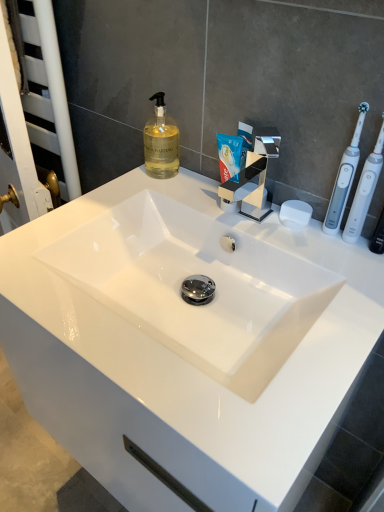
The height and width of the screenshot is (512, 384). Describe the element at coordinates (295, 214) in the screenshot. I see `white matte soap at right` at that location.

Measure the distance between white glossy sink at center and camera.

white glossy sink at center is 16.90 inches away from camera.

You are a GUI agent. You are given a task and a screenshot of the screen. Output one action in this format:
    pyautogui.click(x=<x>, y=<y>)
    Task: Click on the white glossy sink at center
    
    Given the screenshot: What is the action you would take?
    pyautogui.click(x=183, y=343)

Find the location of a particular element. The height and width of the screenshot is (512, 384). chrome metallic tap at center is located at coordinates (253, 177).

This screenshot has height=512, width=384. What do you see at coordinates (253, 177) in the screenshot?
I see `chrome metallic tap at center` at bounding box center [253, 177].

What do you see at coordinates (161, 142) in the screenshot? I see `translucent glass soap dispenser at upper center` at bounding box center [161, 142].

Measure the distance between white plastic toothbrush at right, the first toothbrush when ordered from right to left, and camera.

A distance of 66.32 centimeters exists between white plastic toothbrush at right, the first toothbrush when ordered from right to left, and camera.

Find the location of a particular element. white plastic toothbrush at right, positioned as the second toothbrush in left-to-right order is located at coordinates (364, 191).

Find the location of a particular element. This screenshot has height=512, width=384. white matte soap at right is located at coordinates (295, 214).

Which object is positioned more to the left, white matte soap at right or white plastic screen door at left?

From the viewer's perspective, white plastic screen door at left appears more on the left side.

Can you confirm if white matte soap at right is taller than white plastic screen door at left?

Answer: No.

In the image, there is a white matte soap at right. Where is `screen door above it (from the image's perspective)`? This screenshot has height=512, width=384. screen door above it (from the image's perspective) is located at coordinates (34, 123).

Could you tell me if white matte soap at right is turned towards white plastic screen door at left?

No, white matte soap at right is not turned towards white plastic screen door at left.

Is white plastic toothbrush at right, positioned as the second toothbrush in left-to-right order, a part of white glossy sink at center?

Actually, white plastic toothbrush at right, positioned as the second toothbrush in left-to-right order, is outside white glossy sink at center.

From the image's perspective, is white glossy sink at center on top of white plastic toothbrush at right, the first toothbrush when ordered from right to left?

Actually, white glossy sink at center appears below white plastic toothbrush at right, the first toothbrush when ordered from right to left, in the image.

How many degrees apart are the facing directions of white glossy sink at center and white plastic toothbrush at right, positioned as the second toothbrush in left-to-right order?

The angle between the facing direction of white glossy sink at center and the facing direction of white plastic toothbrush at right, positioned as the second toothbrush in left-to-right order, is 1.31 degrees.

Which of these two, white glossy sink at center or white plastic toothbrush at right, positioned as the second toothbrush in left-to-right order, is bigger?

white glossy sink at center is bigger.

Which is more to the left, white glossy sink at center or white plastic toothbrush at right, the 2th toothbrush in the right-to-left sequence?

white glossy sink at center is more to the left.

From a real-world perspective, is white glossy sink at center beneath white plastic toothbrush at right, the 2th toothbrush in the right-to-left sequence?

Yes, from a real-world perspective, white glossy sink at center is under white plastic toothbrush at right, the 2th toothbrush in the right-to-left sequence.

Does white glossy sink at center have a lesser height compared to white plastic toothbrush at right, the 2th toothbrush in the right-to-left sequence?

Yes.

Which is correct: white plastic screen door at left is inside white glossy sink at center, or outside of it?

white plastic screen door at left is located beyond the bounds of white glossy sink at center.

From the image's perspective, between white plastic screen door at left and white glossy sink at center, who is located below?

From the image's view, white glossy sink at center is below.

Is white plastic screen door at left next to white glossy sink at center and touching it?

white plastic screen door at left is not next to white glossy sink at center, and they're not touching.

Considering the sizes of objects white plastic screen door at left and white glossy sink at center in the image provided, who is taller, white plastic screen door at left or white glossy sink at center?

white plastic screen door at left.

Can you tell me how much white matte soap at right and white plastic toothbrush at right, the 1th toothbrush when ordered from left to right, differ in facing direction?

The angular difference between white matte soap at right and white plastic toothbrush at right, the 1th toothbrush when ordered from left to right, is 4.35 degrees.

From the picture: Which is closer, (x=312, y=210) or (x=347, y=174)?

Point (x=312, y=210) is positioned farther from the camera compared to point (x=347, y=174).

From a real-world perspective, relative to white plastic toothbrush at right, the 1th toothbrush when ordered from left to right, is white matte soap at right vertically above or below?

white matte soap at right is situated lower than white plastic toothbrush at right, the 1th toothbrush when ordered from left to right, in the real world.

Is white matte soap at right taller than white plastic toothbrush at right, the 1th toothbrush when ordered from left to right?

Incorrect, the height of white matte soap at right is not larger of that of white plastic toothbrush at right, the 1th toothbrush when ordered from left to right.

This screenshot has height=512, width=384. Identify the location of soap dispenser below the white plastic toothbrush at right, positioned as the second toothbrush in left-to-right order (from a real-world perspective). tap(161, 142).

Relative to white plastic toothbrush at right, positioned as the second toothbrush in left-to-right order, is translucent glass soap dispenser at upper center in front or behind?

Visually, translucent glass soap dispenser at upper center is located behind white plastic toothbrush at right, positioned as the second toothbrush in left-to-right order.

From a real-world perspective, is translucent glass soap dispenser at upper center below white plastic toothbrush at right, the first toothbrush when ordered from right to left?

Correct, in the physical world, translucent glass soap dispenser at upper center is lower than white plastic toothbrush at right, the first toothbrush when ordered from right to left.

Can you see translucent glass soap dispenser at upper center touching white plastic toothbrush at right, positioned as the second toothbrush in left-to-right order?

No, translucent glass soap dispenser at upper center is not beside white plastic toothbrush at right, positioned as the second toothbrush in left-to-right order.

From a real-world perspective, which object rests below the other?

white matte soap at right.

Which of these two, translucent glass soap dispenser at upper center or white matte soap at right, is smaller?

white matte soap at right is smaller.

From the image's perspective, which one is positioned lower, translucent glass soap dispenser at upper center or white matte soap at right?

white matte soap at right is shown below in the image.

Which is in front, point (157, 151) or point (287, 202)?

Positioned in front is point (287, 202).

In order to click on soap below the white plastic screen door at left (from a real-world perspective) in this screenshot , I will do tap(295, 214).

This screenshot has width=384, height=512. Identify the location of the 1st toothbrush behind when counting from the white glossy sink at center. (364, 191).

Based on their spatial positions, is white plastic toothbrush at right, positioned as the second toothbrush in left-to-right order, or white glossy sink at center further from chrome metallic tap at center?

white glossy sink at center lies further to chrome metallic tap at center than the other object.

Based on their spatial positions, is white plastic screen door at left or translucent glass soap dispenser at upper center closer to white plastic toothbrush at right, the 2th toothbrush in the right-to-left sequence?

translucent glass soap dispenser at upper center is closer to white plastic toothbrush at right, the 2th toothbrush in the right-to-left sequence.

Consider the image. From the image, which object appears to be nearer to white glossy sink at center, white plastic screen door at left or white plastic toothbrush at right, the 1th toothbrush when ordered from left to right?

white plastic toothbrush at right, the 1th toothbrush when ordered from left to right.

Looking at the image, which one is located further to chrome metallic tap at center, white plastic toothbrush at right, the 2th toothbrush in the right-to-left sequence, or translucent glass soap dispenser at upper center?

translucent glass soap dispenser at upper center lies further to chrome metallic tap at center than the other object.

Looking at this image, which object lies nearer to the anchor point white plastic toothbrush at right, positioned as the second toothbrush in left-to-right order, translucent glass soap dispenser at upper center or white plastic toothbrush at right, the 2th toothbrush in the right-to-left sequence?

white plastic toothbrush at right, the 2th toothbrush in the right-to-left sequence, is positioned closer to the anchor white plastic toothbrush at right, positioned as the second toothbrush in left-to-right order.

Considering their positions, is white matte soap at right positioned closer to translucent glass soap dispenser at upper center than white plastic toothbrush at right, the 2th toothbrush in the right-to-left sequence?

The object closer to translucent glass soap dispenser at upper center is white matte soap at right.

Consider the image. When comparing their distances from translucent glass soap dispenser at upper center, does white matte soap at right or chrome metallic tap at center seem closer?

chrome metallic tap at center lies closer to translucent glass soap dispenser at upper center than the other object.

Which object lies nearer to the anchor point chrome metallic tap at center, white plastic screen door at left or translucent glass soap dispenser at upper center?

translucent glass soap dispenser at upper center.

The height and width of the screenshot is (512, 384). In order to click on soap dispenser situated between white plastic screen door at left and white matte soap at right from left to right in this screenshot , I will do `click(161, 142)`.

I want to click on sink between white plastic screen door at left and white plastic toothbrush at right, the 2th toothbrush in the right-to-left sequence, so click(x=183, y=343).

Find the location of `tap between white glossy sink at center and white matte soap at right from front to back`. tap between white glossy sink at center and white matte soap at right from front to back is located at coordinates (253, 177).

Identify the location of tap between white glossy sink at center and translucent glass soap dispenser at upper center along the z-axis. Image resolution: width=384 pixels, height=512 pixels. (253, 177).